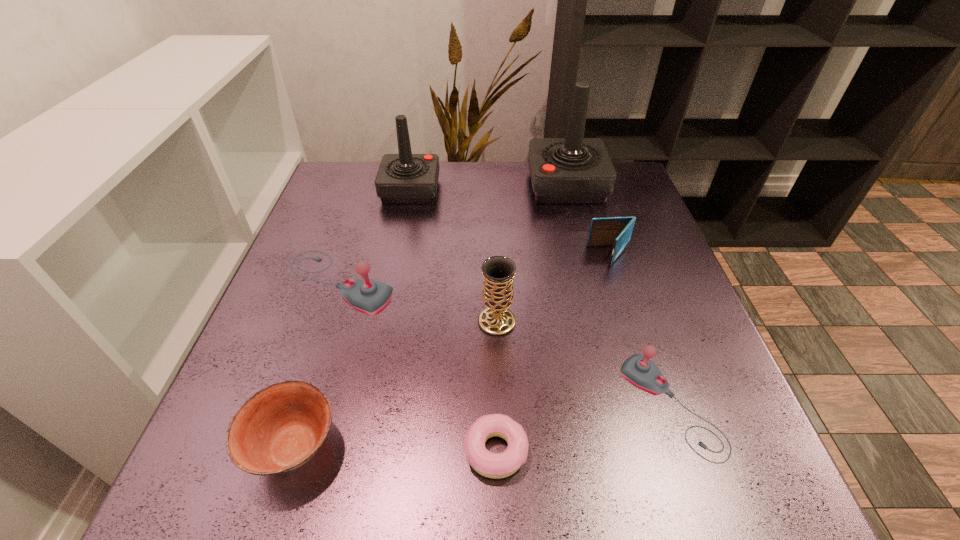
You are a GUI agent. You are given a task and a screenshot of the screen. Output one action in this format:
    pyautogui.click(x=<x>, y=<y>)
    Task: Click on the right red joystick
    Image resolution: width=960 pixels, height=540 pixels.
    Given the screenshot: What is the action you would take?
    pyautogui.click(x=574, y=170)

Locate an element on the screen. This screenshot has height=540, width=960. the tallest object is located at coordinates (574, 170).

You are a GUI agent. You are given a task and a screenshot of the screen. Output one action in this format:
    pyautogui.click(x=<x>, y=<y>)
    Task: Click on the left red joystick
    This screenshot has height=540, width=960.
    Given the screenshot: What is the action you would take?
    pyautogui.click(x=405, y=178)

Where is `the seventh shortest object`? This screenshot has width=960, height=540. the seventh shortest object is located at coordinates (405, 178).

This screenshot has height=540, width=960. What are the coordinates of `the sixth shortest object` in the screenshot? It's located at (498, 272).

This screenshot has height=540, width=960. In order to click on the second shortest joystick in this screenshot , I will do `click(368, 296)`.

At what (x,y) coordinates should I click in order to perform the action: click on the third farthest joystick. Please return your answer as a coordinate pair (x, y). Looking at the image, I should click on (368, 296).

This screenshot has height=540, width=960. In order to click on wallet in this screenshot , I will do `click(612, 231)`.

Where is `the shortest joystick`? Image resolution: width=960 pixels, height=540 pixels. the shortest joystick is located at coordinates (638, 370).

This screenshot has height=540, width=960. I want to click on the nearer gray joystick, so click(638, 370).